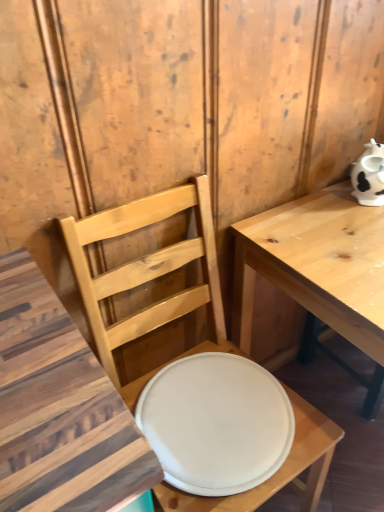
Where is `matte wood chair at center`? The image size is (384, 512). matte wood chair at center is located at coordinates (148, 275).

What is the approximate height of white matte plate at center?

white matte plate at center is 0.95 inches tall.

The width and height of the screenshot is (384, 512). Describe the element at coordinates (216, 423) in the screenshot. I see `white matte plate at center` at that location.

What are the coordinates of `matte wood chair at center` in the screenshot? It's located at (148, 275).

Is matte wood chair at center oriented towards light wood table at right?

No, matte wood chair at center is not turned towards light wood table at right.

Based on their sizes in the image, would you say matte wood chair at center is bigger or smaller than light wood table at right?

Considering their sizes, matte wood chair at center takes up less space than light wood table at right.

How distant is matte wood chair at center from light wood table at right?

matte wood chair at center and light wood table at right are 25.46 centimeters apart.

What's the angular difference between matte wood chair at center and light wood table at right's facing directions?

0.672 degrees.

From the image's perspective, is light wood table at right under matte wood chair at center?

Incorrect, from the image's perspective, light wood table at right is higher than matte wood chair at center.

Are light wood table at right and matte wood chair at center far apart?

No, there isn't a large distance between light wood table at right and matte wood chair at center.

Is light wood table at right not inside matte wood chair at center?

Absolutely, light wood table at right is external to matte wood chair at center.

Considering the relative sizes of light wood table at right and matte wood chair at center in the image provided, is light wood table at right smaller than matte wood chair at center?

No.

Is the position of white matte plate at center more distant than that of light wood table at right?

Yes, it is.

Is point (271, 418) positioned behind point (241, 291)?

No, (271, 418) is closer to viewer.

Is white matte plate at center shorter than light wood table at right?

Indeed, white matte plate at center has a lesser height compared to light wood table at right.

Is the surface of white matte plate at center in direct contact with light wood table at right?

No, white matte plate at center is not beside light wood table at right.

Is point (206, 179) closer or farther from the camera than point (214, 412)?

Point (206, 179) is positioned farther from the camera compared to point (214, 412).

Is matte wood chair at center next to white matte plate at center and touching it?

No, matte wood chair at center is not in contact with white matte plate at center.

Measure the distance from matte wood chair at center to white matte plate at center.

matte wood chair at center is 4.59 inches away from white matte plate at center.

Is matte wood chair at center in front of or behind white matte plate at center in the image?

matte wood chair at center is positioned closer to the viewer than white matte plate at center.

From the picture: From a real-world perspective, who is located lower, light wood table at right or white matte plate at center?

light wood table at right, from a real-world perspective.

Identify the location of plate that is above the light wood table at right (from a real-world perspective). The height and width of the screenshot is (512, 384). (216, 423).

Is light wood table at right further to camera compared to white matte plate at center?

No.

Is point (208, 403) positioned in front of point (212, 290)?

Yes, point (208, 403) is in front of point (212, 290).

Could you tell me if white matte plate at center is facing matte wood chair at center?

Yes, white matte plate at center is facing matte wood chair at center.

Is white matte plate at center far away from matte wood chair at center?

That's not correct — white matte plate at center is a little close to matte wood chair at center.

Where is `chair lying on the left of light wood table at right`? The width and height of the screenshot is (384, 512). chair lying on the left of light wood table at right is located at coordinates (148, 275).

Locate an element on the screen. chair in front of the light wood table at right is located at coordinates (148, 275).

Considering their positions, is light wood table at right positioned further to matte wood chair at center than white matte plate at center?

light wood table at right.

Which object lies further to the anchor point white matte plate at center, matte wood chair at center or light wood table at right?

Among the two, light wood table at right is located further to white matte plate at center.

When comparing their distances from matte wood chair at center, does white matte plate at center or light wood table at right seem further?

Based on the image, light wood table at right appears to be further to matte wood chair at center.

When comparing their distances from white matte plate at center, does light wood table at right or matte wood chair at center seem further?

The object further to white matte plate at center is light wood table at right.

When comparing their distances from light wood table at right, does matte wood chair at center or white matte plate at center seem closer?

matte wood chair at center is positioned closer to the anchor light wood table at right.

From the image, which object appears to be nearer to light wood table at right, white matte plate at center or matte wood chair at center?

Based on the image, matte wood chair at center appears to be nearer to light wood table at right.

Locate an element on the screen. The height and width of the screenshot is (512, 384). plate between matte wood chair at center and light wood table at right from left to right is located at coordinates (216, 423).